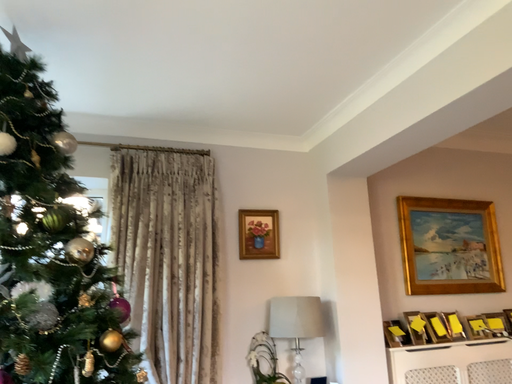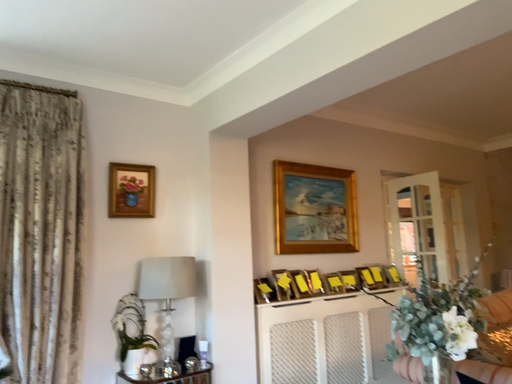
Question: Which way did the camera rotate in the video?

Choices:
 (A) rotated left
 (B) rotated right

Answer: (B)